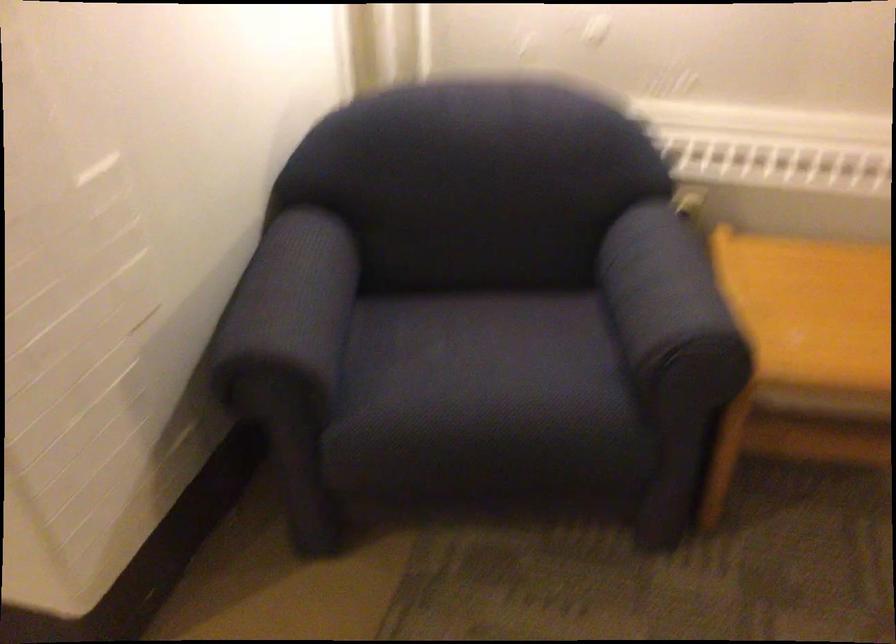
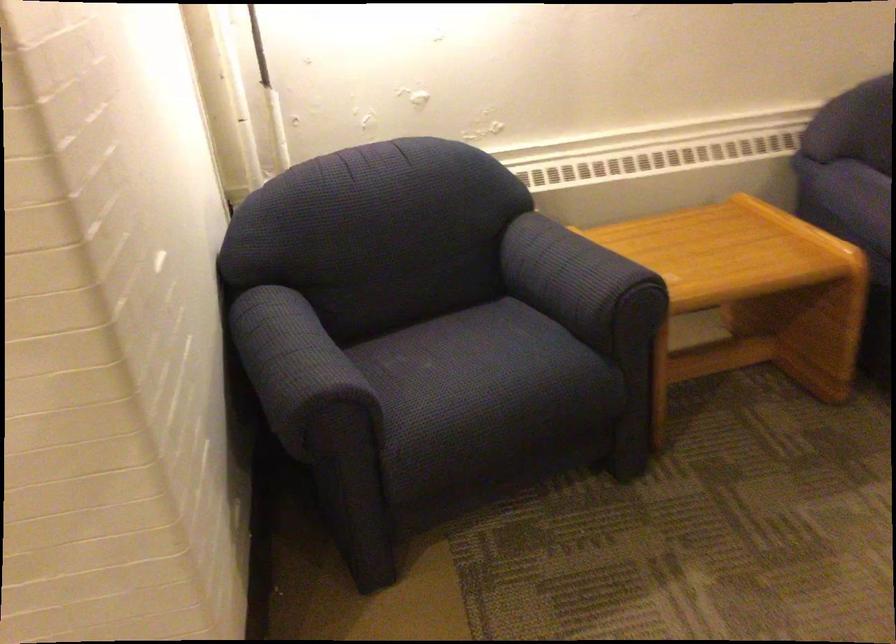
Find the pixel in the second image that matches (471,389) in the first image.

(487, 377)